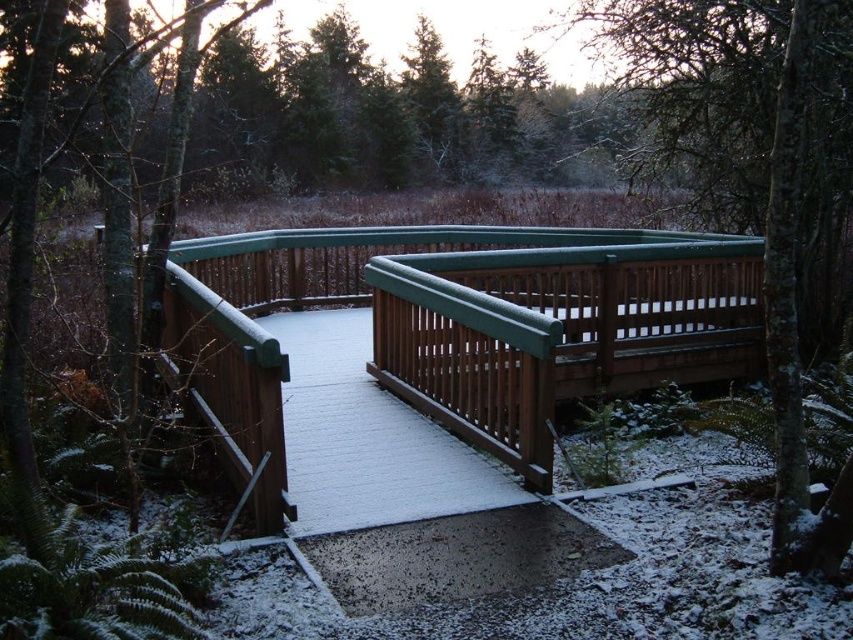
Can you confirm if wooden bridge at center is positioned to the left of green matte fence at upper center?

Indeed, wooden bridge at center is positioned on the left side of green matte fence at upper center.

Is point (448, 237) positioned behind point (697, 161)?

That is False.

Locate an element on the screen. wooden bridge at center is located at coordinates (460, 324).